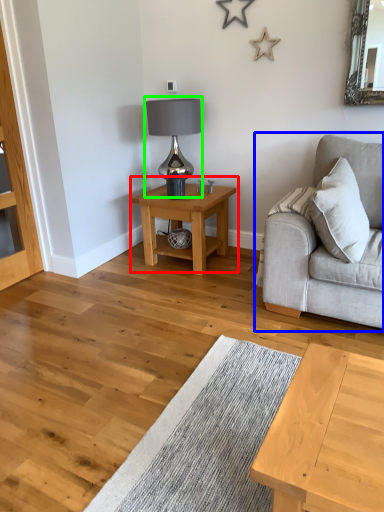
Question: Considering the real-world distances, which object is farthest from table (highlighted by a red box)? studio couch (highlighted by a blue box) or table lamp (highlighted by a green box)?

Choices:
 (A) studio couch
 (B) table lamp

Answer: (A)